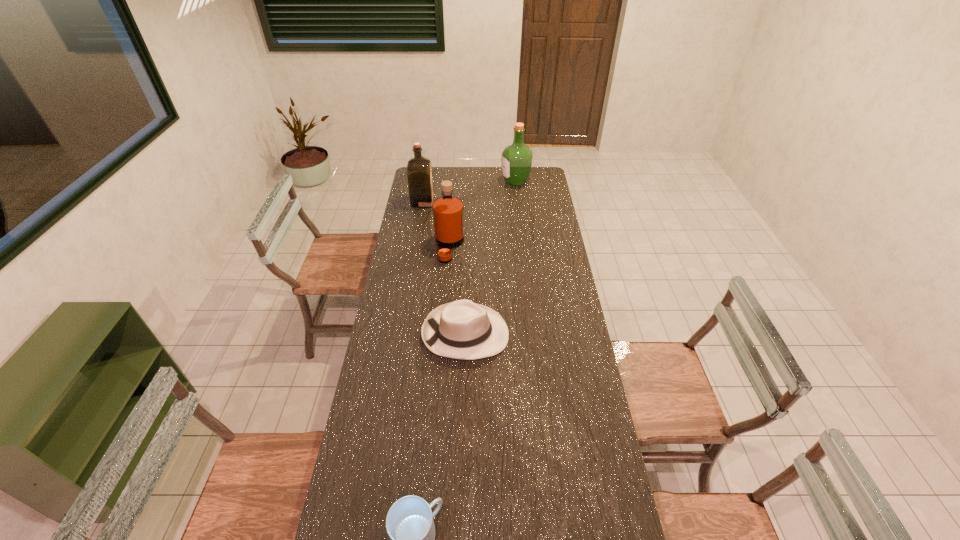
Identify the location of the farthest object. The height and width of the screenshot is (540, 960). (516, 164).

Find the location of a particular element. the farthest liquor is located at coordinates (516, 164).

Identify the location of the leftmost liquor. (419, 169).

Where is `the second farthest object`? The image size is (960, 540). the second farthest object is located at coordinates coord(419,169).

Identify the location of the nearest liquor. This screenshot has width=960, height=540. (448, 215).

Identify the location of the second liquor from right to left. Image resolution: width=960 pixels, height=540 pixels. (448, 215).

The height and width of the screenshot is (540, 960). Identify the location of the second nearest object. (464, 330).

Find the location of a particular element. The height and width of the screenshot is (540, 960). free space located 0.170m on the front-facing side of the farthest liquor is located at coordinates (471, 181).

Find the location of a particular element. Image resolution: width=960 pixels, height=540 pixels. vacant area situated 0.050m on the front-facing side of the farthest liquor is located at coordinates (492, 181).

This screenshot has width=960, height=540. In order to click on blank space located on the front-facing side of the farthest liquor in this screenshot , I will do `click(461, 181)`.